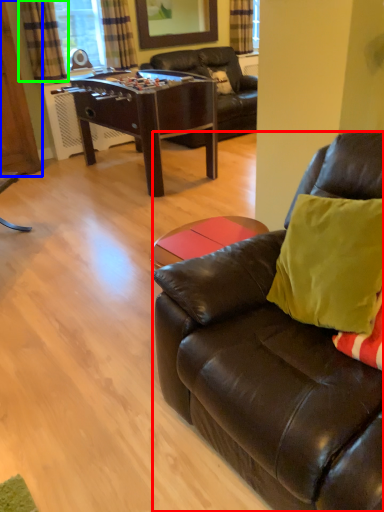
Question: Considering the real-world distances, which object is closest to studio couch (highlighted by a red box)? armoire (highlighted by a blue box) or curtain (highlighted by a green box).

Choices:
 (A) armoire
 (B) curtain

Answer: (A)